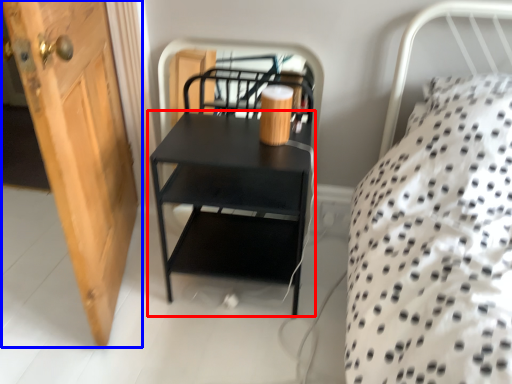
Question: Which object is further to the camera taking this photo, nightstand (highlighted by a red box) or door (highlighted by a blue box)?

Choices:
 (A) nightstand
 (B) door

Answer: (A)